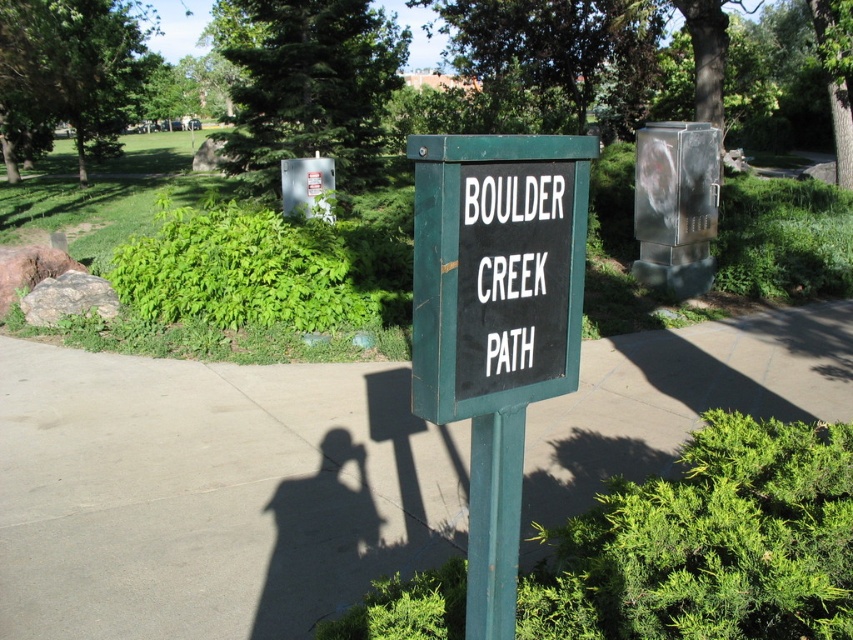
Which is in front, point (306, 396) or point (469, 138)?

Point (469, 138) is more forward.

I want to click on gray concrete pavement at center, so click(210, 493).

Locate an element on the screen. The height and width of the screenshot is (640, 853). gray concrete pavement at center is located at coordinates (210, 493).

Can you confirm if green matte sign at center is wider than black plastic sign at center?

Correct, the width of green matte sign at center exceeds that of black plastic sign at center.

Which of these two, green matte sign at center or black plastic sign at center, stands taller?

With more height is green matte sign at center.

Image resolution: width=853 pixels, height=640 pixels. Find the location of `green matte sign at center`. green matte sign at center is located at coordinates (495, 321).

Locate an element on the screen. green matte sign at center is located at coordinates (495, 321).

Between gray concrete pavement at center and black plastic sign at center, which one appears on the right side from the viewer's perspective?

black plastic sign at center is more to the right.

Does gray concrete pavement at center have a greater height compared to black plastic sign at center?

No.

This screenshot has height=640, width=853. What do you see at coordinates (210, 493) in the screenshot? I see `gray concrete pavement at center` at bounding box center [210, 493].

In order to click on gray concrete pavement at center in this screenshot , I will do `click(210, 493)`.